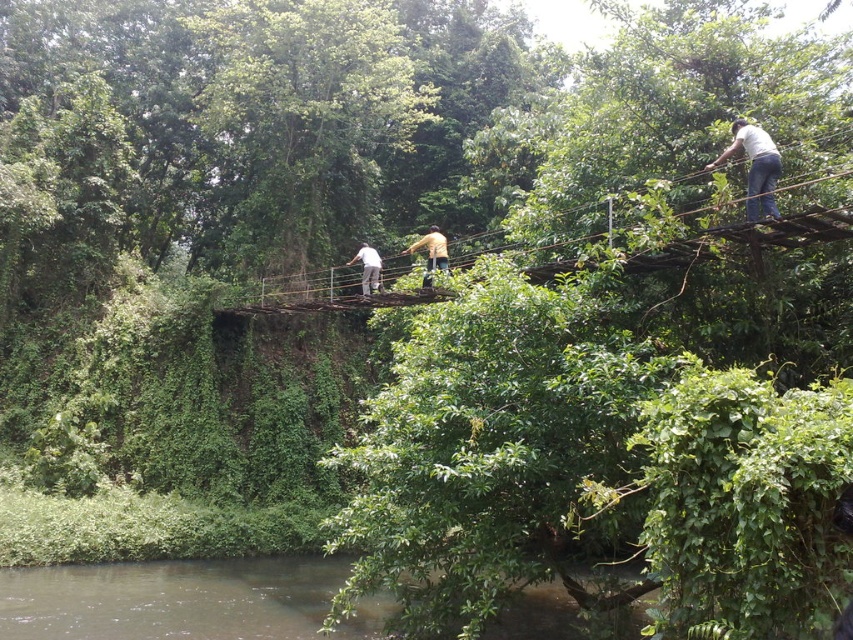
Who is higher up, brown murky water at lower left or white matte shirt at center?

white matte shirt at center

Is point (3, 598) more distant than point (361, 276)?

No, (3, 598) is in front of (361, 276).

What do you see at coordinates (183, 600) in the screenshot?
I see `brown murky water at lower left` at bounding box center [183, 600].

Identify the location of brown murky water at lower left. The image size is (853, 640). (183, 600).

Between point (434, 236) and point (378, 284), which one is positioned behind?

The point (378, 284) is more distant.

Which is more to the right, yellow fabric shirt at center or white matte shirt at center?

From the viewer's perspective, yellow fabric shirt at center appears more on the right side.

Locate an element on the screen. yellow fabric shirt at center is located at coordinates (431, 252).

Is brown wooden bridge at center positioned before white cotton shirt at upper right?

Yes.

Between brown wooden bridge at center and white cotton shirt at upper right, which one has more height?

brown wooden bridge at center

Is point (419, 294) farther from viewer compared to point (747, 198)?

That is True.

Where is `brown wooden bridge at center`? Image resolution: width=853 pixels, height=640 pixels. brown wooden bridge at center is located at coordinates (749, 237).